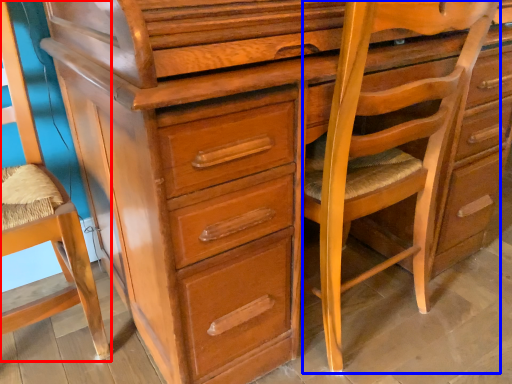
Question: Which object is closer to the camera taking this photo, swivel chair (highlighted by a red box) or rocking chair (highlighted by a blue box)?

Choices:
 (A) swivel chair
 (B) rocking chair

Answer: (A)